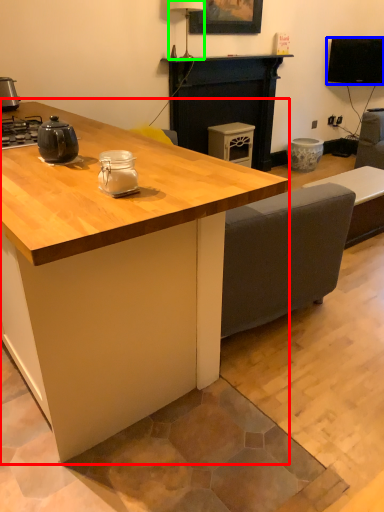
Question: Which object is the farthest from table (highlighted by a red box)? Choose among these: television (highlighted by a blue box) or lamp (highlighted by a green box).

Choices:
 (A) television
 (B) lamp

Answer: (A)